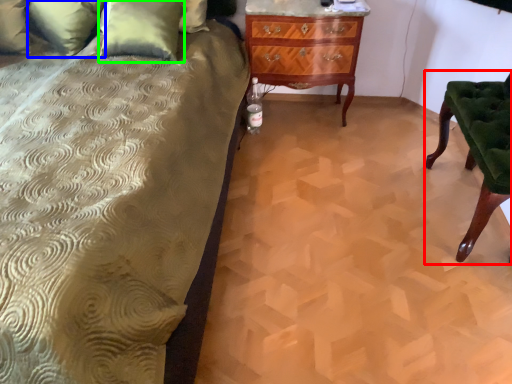
Question: Which object is positioned farthest from furniture (highlighted by a red box)? Select from pillow (highlighted by a blue box) and pillow (highlighted by a green box).

Choices:
 (A) pillow
 (B) pillow

Answer: (A)